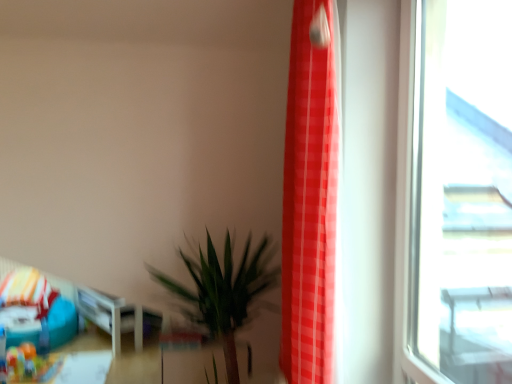
Question: From a real-world perspective, is green leafy plant at lower center on teal fabric bean bag at lower left?

Choices:
 (A) no
 (B) yes

Answer: (B)

Question: Is green leafy plant at lower center at the right side of teal fabric bean bag at lower left?

Choices:
 (A) yes
 (B) no

Answer: (A)

Question: Does green leafy plant at lower center turn towards teal fabric bean bag at lower left?

Choices:
 (A) no
 (B) yes

Answer: (A)

Question: Considering the relative sizes of green leafy plant at lower center and teal fabric bean bag at lower left in the image provided, is green leafy plant at lower center smaller than teal fabric bean bag at lower left?

Choices:
 (A) yes
 (B) no

Answer: (A)

Question: Is green leafy plant at lower center outside teal fabric bean bag at lower left?

Choices:
 (A) yes
 (B) no

Answer: (A)

Question: Looking at the image, does teal fabric bean bag at lower left seem bigger or smaller compared to red checkered curtain at right?

Choices:
 (A) small
 (B) big

Answer: (B)

Question: Is teal fabric bean bag at lower left taller or shorter than red checkered curtain at right?

Choices:
 (A) short
 (B) tall

Answer: (A)

Question: In the image, is teal fabric bean bag at lower left positioned in front of or behind red checkered curtain at right?

Choices:
 (A) front
 (B) behind

Answer: (B)

Question: From the image's perspective, is teal fabric bean bag at lower left above or below red checkered curtain at right?

Choices:
 (A) above
 (B) below

Answer: (B)

Question: Is point (24, 281) closer or farther from the camera than point (202, 286)?

Choices:
 (A) farther
 (B) closer

Answer: (A)

Question: From a real-world perspective, is teal fabric bean bag at lower left physically located above or below green leafy plant at lower center?

Choices:
 (A) below
 (B) above

Answer: (A)

Question: Visually, is teal fabric bean bag at lower left positioned to the left or to the right of green leafy plant at lower center?

Choices:
 (A) left
 (B) right

Answer: (A)

Question: Do you think teal fabric bean bag at lower left is within green leafy plant at lower center, or outside of it?

Choices:
 (A) outside
 (B) inside

Answer: (A)

Question: Is transparent glass window at right in front of or behind teal fabric bean bag at lower left in the image?

Choices:
 (A) behind
 (B) front

Answer: (B)

Question: Considering the positions of transparent glass window at right and teal fabric bean bag at lower left in the image, is transparent glass window at right taller or shorter than teal fabric bean bag at lower left?

Choices:
 (A) tall
 (B) short

Answer: (A)